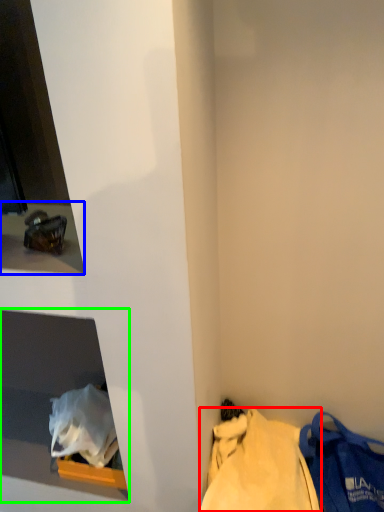
Question: Based on their relative distances, which object is farther from tote bag (highlighted by a red box)? Choose from window sill (highlighted by a blue box) and cabinet (highlighted by a green box).

Choices:
 (A) window sill
 (B) cabinet

Answer: (A)